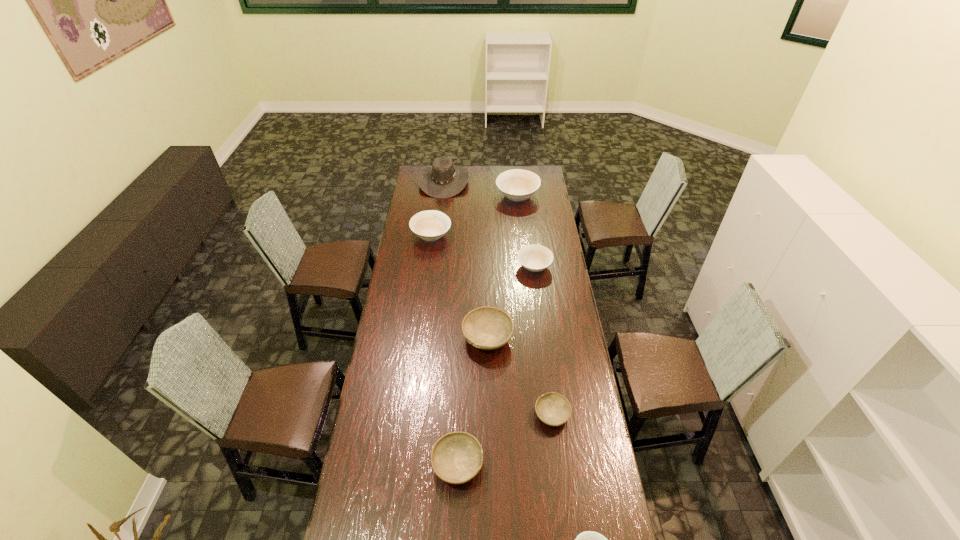
At what (x,y) coordinates should I click in order to perform the action: click on cowboy hat that is positioned at the far edge. Please return your answer as a coordinate pair (x, y). The height and width of the screenshot is (540, 960). Looking at the image, I should click on (443, 179).

The height and width of the screenshot is (540, 960). In order to click on bowl present at the far edge in this screenshot , I will do `click(518, 185)`.

You are a GUI agent. You are given a task and a screenshot of the screen. Output one action in this format:
    pyautogui.click(x=<x>, y=<y>)
    Task: Click on the cowboy hat situated at the left edge
    Image resolution: width=960 pixels, height=540 pixels.
    Given the screenshot: What is the action you would take?
    coord(443,179)

This screenshot has width=960, height=540. I want to click on bowl at the left edge, so click(430, 225).

I want to click on object that is at the far left corner, so click(x=443, y=179).

Locate an element on the screen. Image resolution: width=960 pixels, height=540 pixels. object that is at the far right corner is located at coordinates (518, 185).

Where is `vacant space at the far edge of the desktop`? The image size is (960, 540). vacant space at the far edge of the desktop is located at coordinates (492, 181).

Locate an element on the screen. free region at the left edge of the desktop is located at coordinates (408, 258).

The image size is (960, 540). In the image, there is a desktop. Identify the location of vacant area at the right edge. (551, 211).

At what (x,y) coordinates should I click in order to perform the action: click on free space between the second smallest gray bowl and the tallest object. Please return your answer as a coordinate pair (x, y). This screenshot has height=540, width=960. Looking at the image, I should click on (450, 323).